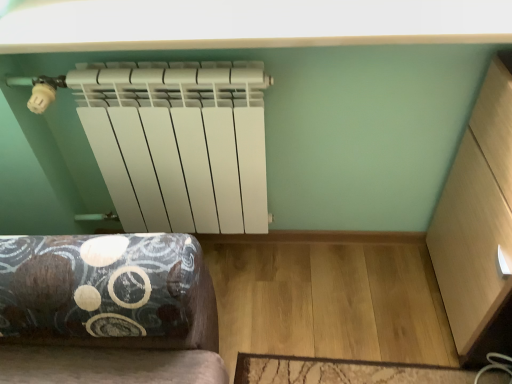
Image resolution: width=512 pixels, height=384 pixels. What are the coordinates of `white matte radiator at left` in the screenshot? It's located at (179, 142).

Describe the element at coordinates (179, 142) in the screenshot. I see `white matte radiator at left` at that location.

Where is `white matte radiator at left`? The height and width of the screenshot is (384, 512). white matte radiator at left is located at coordinates (179, 142).